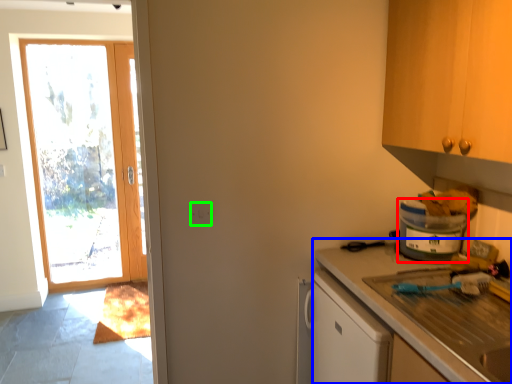
Question: Which object is the closest to the appliance (highlighted by a red box)? Choose among these: countertop (highlighted by a blue box) or electric outlet (highlighted by a green box).

Choices:
 (A) countertop
 (B) electric outlet

Answer: (A)